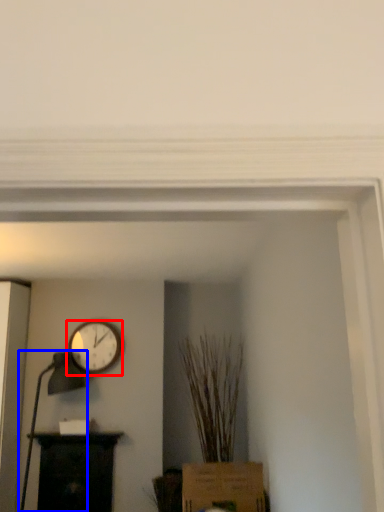
Question: Which object appears farthest to the camera in this image, wall clock (highlighted by a red box) or table lamp (highlighted by a blue box)?

Choices:
 (A) wall clock
 (B) table lamp

Answer: (A)